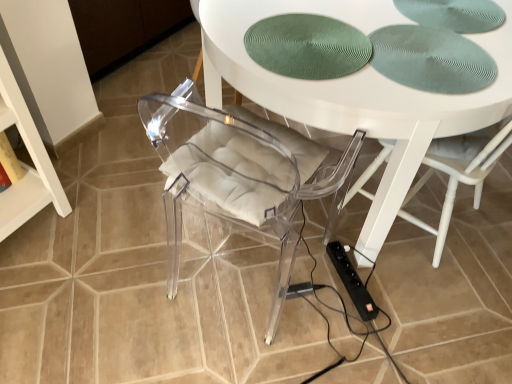
Where is `black plastic extension cord at lower right`? black plastic extension cord at lower right is located at coordinates (352, 282).

The height and width of the screenshot is (384, 512). What do you see at coordinates (352, 282) in the screenshot?
I see `black plastic extension cord at lower right` at bounding box center [352, 282].

Consider the image. What is the approximate height of black plastic extension cord at lower right?

It is 3.16 inches.

In the scene shown: In order to face black plastic extension cord at lower right, should I rotate leftwards or rightwards?

It's best to rotate right around 13.120 degrees.

This screenshot has height=384, width=512. Find the location of `white glossy table at center`. white glossy table at center is located at coordinates (354, 91).

What is the approximate width of white glossy table at center?

3.82 feet.

What is the approximate height of white glossy table at center?

The height of white glossy table at center is 30.06 inches.

What do you see at coordinates (354, 91) in the screenshot?
I see `white glossy table at center` at bounding box center [354, 91].

Locate an element on the screen. The width and height of the screenshot is (512, 384). black plastic extension cord at lower right is located at coordinates [352, 282].

Which is more to the left, black plastic extension cord at lower right or white glossy table at center?

black plastic extension cord at lower right is more to the left.

Between black plastic extension cord at lower right and white glossy table at center, which one is positioned behind?

black plastic extension cord at lower right is more distant.

Considering the positions of point (343, 282) and point (219, 57), is point (343, 282) closer or farther from the camera than point (219, 57)?

Point (343, 282).

From the image's perspective, is black plastic extension cord at lower right above or below white glossy table at center?

black plastic extension cord at lower right is below white glossy table at center.

From a real-world perspective, which object rests below the other?

black plastic extension cord at lower right, from a real-world perspective.

Considering the sizes of black plastic extension cord at lower right and white glossy table at center in the image, is black plastic extension cord at lower right wider or thinner than white glossy table at center?

In the image, black plastic extension cord at lower right appears to be more narrow than white glossy table at center.

Can you confirm if black plastic extension cord at lower right is taller than white glossy table at center?

Incorrect, the height of black plastic extension cord at lower right is not larger of that of white glossy table at center.

Considering the relative sizes of black plastic extension cord at lower right and white glossy table at center in the image provided, is black plastic extension cord at lower right bigger than white glossy table at center?

Actually, black plastic extension cord at lower right might be smaller than white glossy table at center.

Is black plastic extension cord at lower right completely or partially outside of white glossy table at center?

No, black plastic extension cord at lower right is inside or overlapping with white glossy table at center.

Is black plastic extension cord at lower right directly adjacent to white glossy table at center?

No, black plastic extension cord at lower right is not in contact with white glossy table at center.

Is black plastic extension cord at lower right positioned with its back to white glossy table at center?

→ Yes.

Can you tell me how much black plastic extension cord at lower right and white glossy table at center differ in facing direction?

black plastic extension cord at lower right and white glossy table at center are facing 131 degrees away from each other.

Measure the distance from black plastic extension cord at lower right to white glossy table at center.

They are 22.22 inches apart.

Locate an element on the screen. The image size is (512, 384). extension cord below the white glossy table at center (from the image's perspective) is located at coordinates (352, 282).

Is white glossy table at center to the left of black plastic extension cord at lower right from the viewer's perspective?

No.

Who is more distant, white glossy table at center or black plastic extension cord at lower right?

black plastic extension cord at lower right is further away from the camera.

Considering the points (217, 46) and (341, 266), which point is in front, point (217, 46) or point (341, 266)?

Positioned in front is point (217, 46).

From the image's perspective, which one is positioned lower, white glossy table at center or black plastic extension cord at lower right?

black plastic extension cord at lower right appears lower in the image.

From a real-world perspective, is white glossy table at center positioned over black plastic extension cord at lower right based on gravity?

Indeed, from a real-world perspective, white glossy table at center stands above black plastic extension cord at lower right.

Which of these two, white glossy table at center or black plastic extension cord at lower right, is thinner?

black plastic extension cord at lower right.

Which of these two, white glossy table at center or black plastic extension cord at lower right, stands shorter?

Standing shorter between the two is black plastic extension cord at lower right.

Which of these two, white glossy table at center or black plastic extension cord at lower right, is smaller?

Smaller between the two is black plastic extension cord at lower right.

Can black plastic extension cord at lower right be found inside white glossy table at center?

Yes.

In the scene shown: Would you consider white glossy table at center to be distant from black plastic extension cord at lower right?

No, there isn't a large distance between white glossy table at center and black plastic extension cord at lower right.

Is white glossy table at center facing away from black plastic extension cord at lower right?

white glossy table at center is not turned away from black plastic extension cord at lower right.

Identify the location of extension cord behind the white glossy table at center. This screenshot has height=384, width=512. (352, 282).

I want to click on extension cord below the white glossy table at center (from the image's perspective), so (352, 282).

Identify the location of table that is in front of the black plastic extension cord at lower right. This screenshot has width=512, height=384. (354, 91).